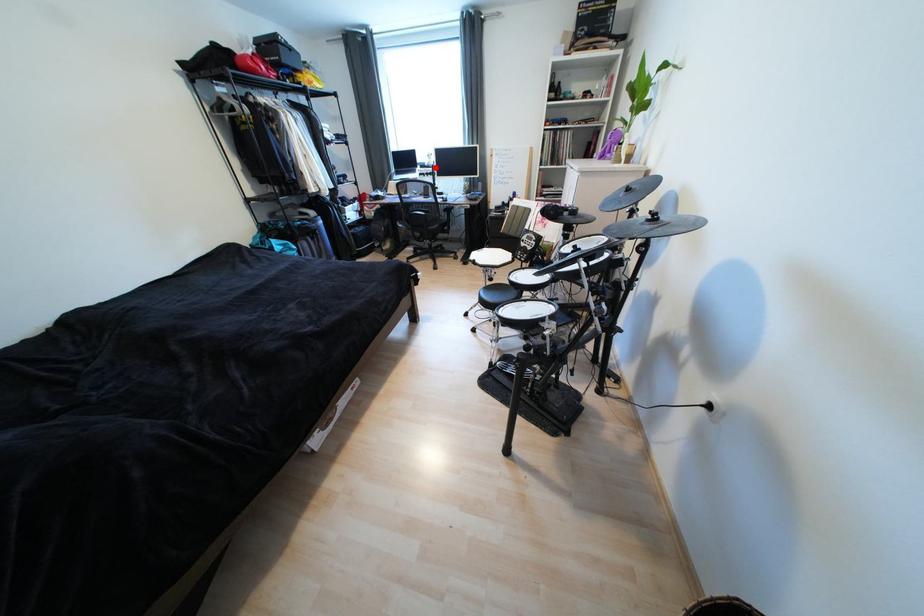
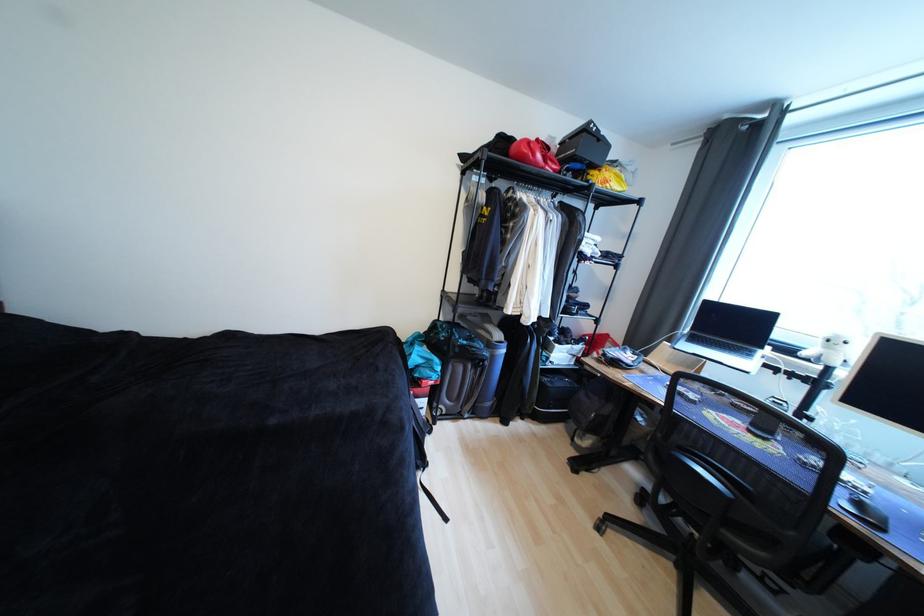
Find the pixel in the second image that matches the highlighted location in the first image.

(812, 361)